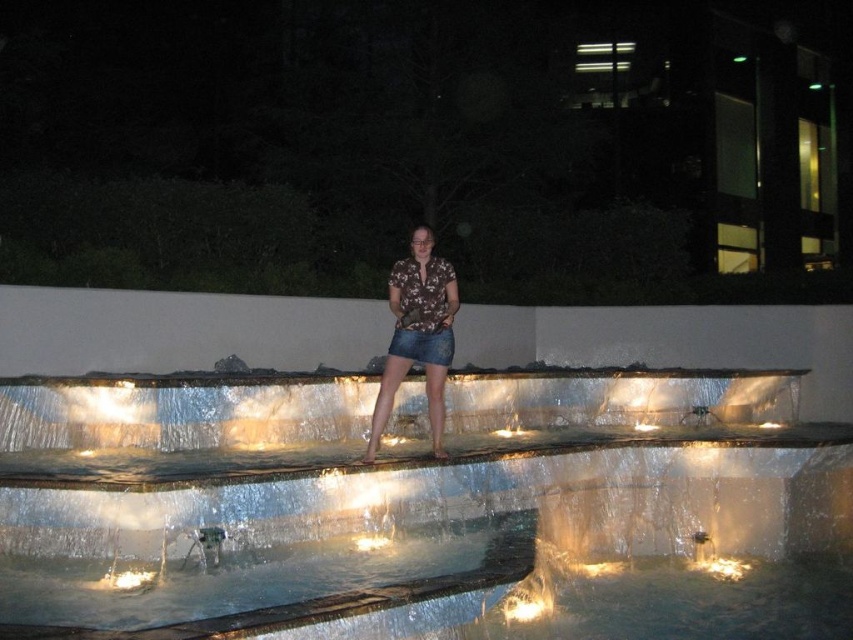
Looking at this image, between brown floral shirt at center and denim skirt at center, which one appears on the left side from the viewer's perspective?

brown floral shirt at center

Does brown floral shirt at center have a lesser width compared to denim skirt at center?

No, brown floral shirt at center is not thinner than denim skirt at center.

Is point (396, 282) behind point (390, 349)?

No, (396, 282) is in front of (390, 349).

This screenshot has height=640, width=853. What are the coordinates of `brown floral shirt at center` in the screenshot? It's located at 416,333.

Who is positioned more to the left, clear glass water at center or brown floral shirt at center?

brown floral shirt at center

Does clear glass water at center lie behind brown floral shirt at center?

No, it is not.

This screenshot has height=640, width=853. What do you see at coordinates (422, 509) in the screenshot?
I see `clear glass water at center` at bounding box center [422, 509].

The image size is (853, 640). I want to click on clear glass water at center, so click(422, 509).

Does point (685, 376) come behind point (426, 339)?

That is True.

Which is in front, point (299, 580) or point (451, 349)?

Point (299, 580) is more forward.

You are a GUI agent. You are given a task and a screenshot of the screen. Output one action in this format:
    pyautogui.click(x=<x>, y=<y>)
    Task: Click on the clear glass water at center
    
    Given the screenshot: What is the action you would take?
    pos(422,509)